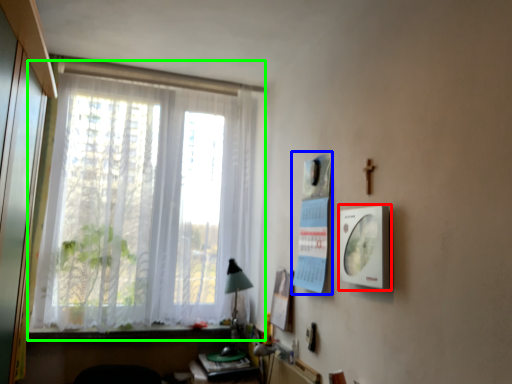
Question: Which object is positioned closest to picture frame (highlighted by a red box)? Select from poster page (highlighted by a blue box) and window (highlighted by a green box).

Choices:
 (A) poster page
 (B) window

Answer: (A)